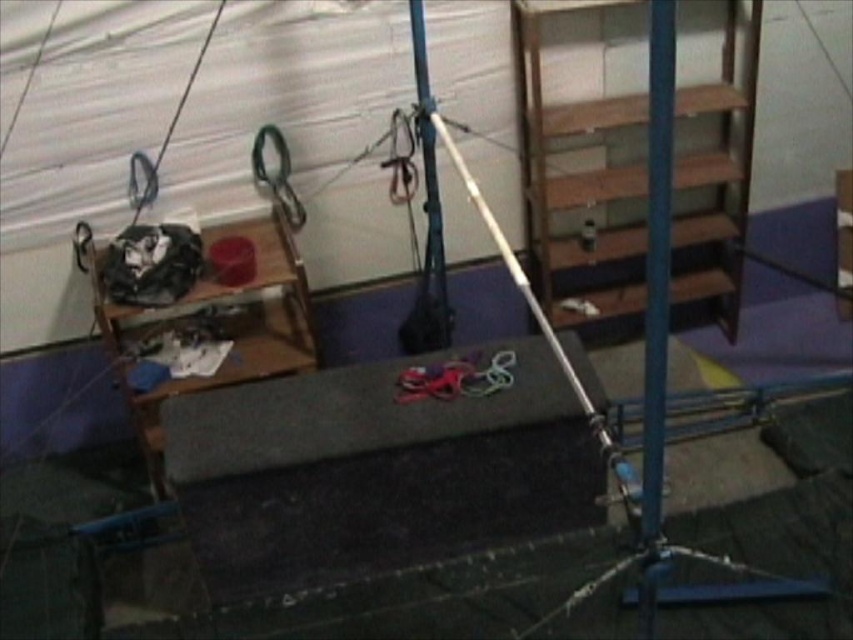
Is wooden at left closer to the viewer compared to blue metallic pole at center-right?

No, wooden at left is further to the viewer.

Is wooden at left to the right of blue metallic pole at center-right from the viewer's perspective?

No, wooden at left is not to the right of blue metallic pole at center-right.

At what (x,y) coordinates should I click in order to perform the action: click on wooden at left. Please return your answer as a coordinate pair (x, y). This screenshot has height=640, width=853. Looking at the image, I should click on (218, 324).

This screenshot has height=640, width=853. Find the location of `wooden at left`. wooden at left is located at coordinates (218, 324).

How much distance is there between blue metallic pole at center-right and blue metallic pole at center?

blue metallic pole at center-right is 4.96 feet from blue metallic pole at center.

Identify the location of blue metallic pole at center-right. This screenshot has height=640, width=853. (656, 307).

Where is `blue metallic pole at center-right`? This screenshot has width=853, height=640. blue metallic pole at center-right is located at coordinates (656, 307).

Is wooden at left above blue metallic pole at center?

No, wooden at left is not above blue metallic pole at center.

Is wooden at left bigger than blue metallic pole at center?

Yes.

Between point (302, 369) and point (422, 273), which one is positioned in front?

Point (302, 369)

Locate an element on the screen. This screenshot has height=640, width=853. wooden at left is located at coordinates (218, 324).